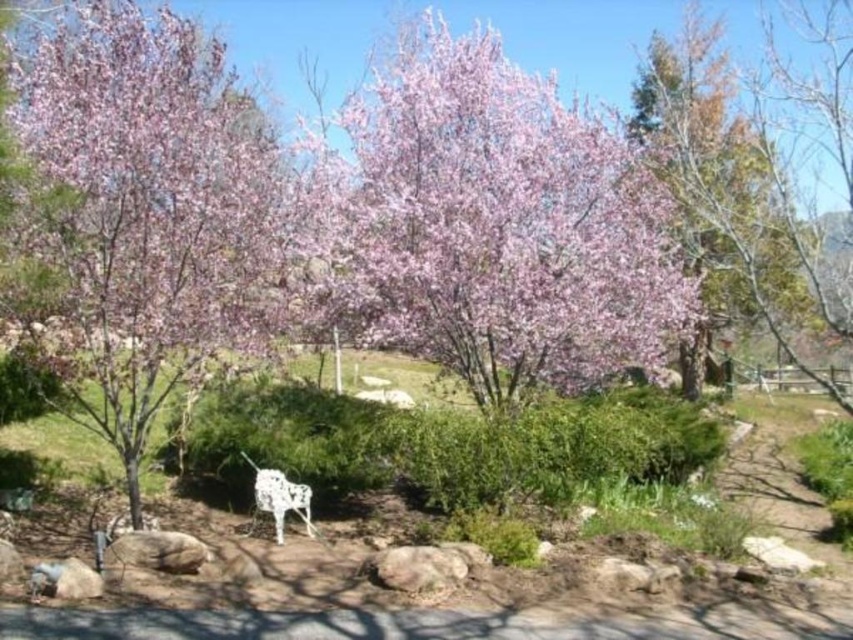
Question: Is pink blossoming tree at upper right in front of white metallic chair at center?

Choices:
 (A) yes
 (B) no

Answer: (B)

Question: Does pink matte flower at upper center appear on the left side of white metallic chair at center?

Choices:
 (A) no
 (B) yes

Answer: (A)

Question: Which point is closer to the camera?

Choices:
 (A) pink matte flower at upper center
 (B) white metallic horse at center
 (C) white metallic chair at center
 (D) pink blossoming tree at upper right

Answer: (C)

Question: Which point is farther to the camera?

Choices:
 (A) (659, 100)
 (B) (276, 534)

Answer: (A)

Question: Which of the following is the farthest from the observer?

Choices:
 (A) (506, 131)
 (B) (717, 124)
 (C) (500, 436)

Answer: (B)

Question: Is white metallic horse at center to the right of white metallic chair at center from the viewer's perspective?

Choices:
 (A) no
 (B) yes

Answer: (A)